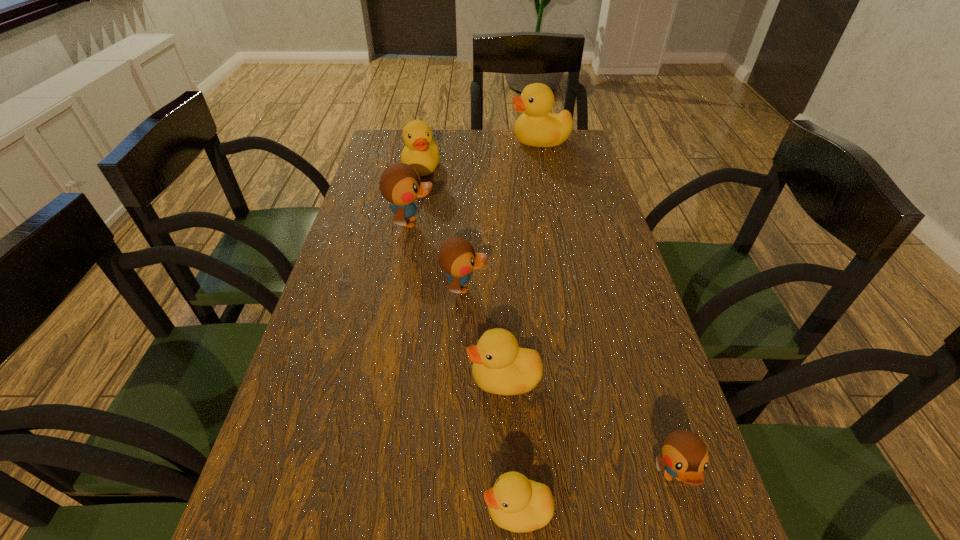
Find the location of a particular element. Image resolution: width=960 pixels, height=540 pixels. object that is the closest to the second smallest yellow duck is located at coordinates (515, 503).

Select which object appears as the fifth closest to the third biggest yellow duck. Please provide its 2D coordinates. Your answer should be formatted as a tuple, i.e. [(x, y)], where the tuple contains the x and y coordinates of a point satisfying the conditions above.

[(421, 152)]

At what (x,y) coordinates should I click in order to perform the action: click on the closest duck to the nearest yellow duck. Please return your answer as a coordinate pair (x, y). The height and width of the screenshot is (540, 960). Looking at the image, I should click on pyautogui.click(x=500, y=366).

Identify the location of duck that is the third closest one to the second blue duck from left to right. This screenshot has width=960, height=540. (515, 503).

Identify the location of yellow duck that is the closest to the farthest object. The width and height of the screenshot is (960, 540). (421, 152).

Identify the location of yellow duck that is the fourth closest to the nearest blue duck. This screenshot has width=960, height=540. (536, 127).

At what (x,y) coordinates should I click in order to perform the action: click on blue duck identified as the second closest to the biggest blue duck. Please return your answer as a coordinate pair (x, y). Looking at the image, I should click on (685, 456).

Select which blue duck is the closest to the fifth nearest duck. Please provide its 2D coordinates. Your answer should be formatted as a tuple, i.e. [(x, y)], where the tuple contains the x and y coordinates of a point satisfying the conditions above.

[(457, 257)]

The height and width of the screenshot is (540, 960). I want to click on vacant space that satisfies the following two spatial constraints: 1. at the beak of the biggest yellow duck; 2. at the beak of the leftmost yellow duck, so click(545, 167).